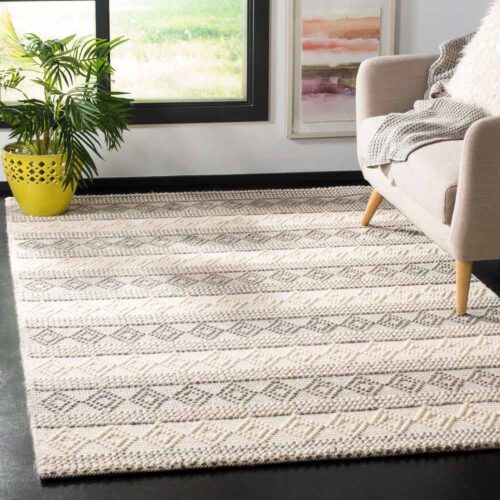
Locate an element on the screen. This screenshot has height=500, width=500. chair legs is located at coordinates (375, 203), (461, 284).